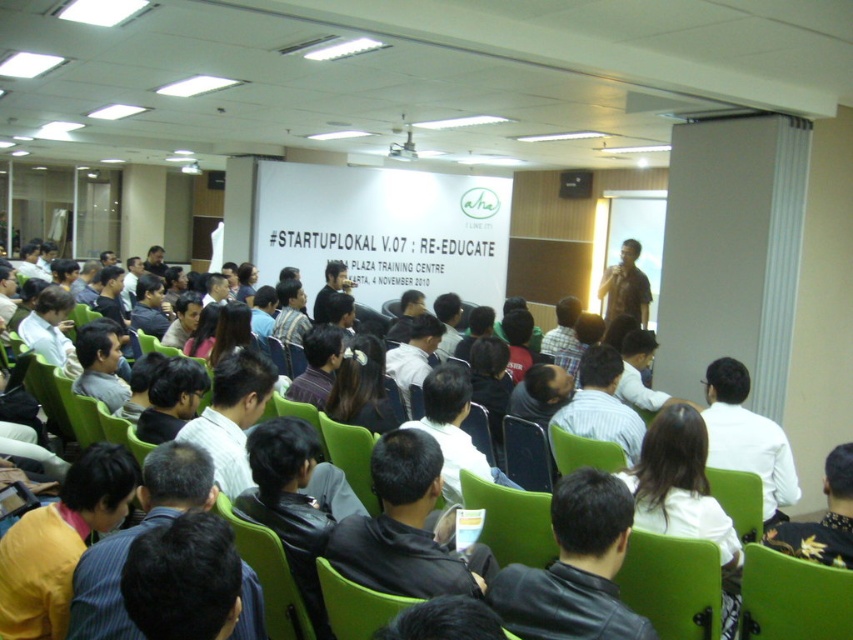
Question: Which point appears closest to the camera in this image?

Choices:
 (A) (349, 413)
 (B) (773, 566)

Answer: (B)

Question: Based on their relative distances, which object is nearer to the green fabric chair at lower right?

Choices:
 (A) yellow shirt at lower left
 (B) black leather jacket at lower right

Answer: (B)

Question: Does black hair at center have a lesser width compared to matte white shirt at center?

Choices:
 (A) yes
 (B) no

Answer: (A)

Question: Does yellow shirt at lower left appear on the left side of dark brown leather jacket at lower left?

Choices:
 (A) no
 (B) yes

Answer: (A)

Question: Which of the following is the closest to the observer?

Choices:
 (A) black hair at center
 (B) black leather jacket at lower right
 (C) dark brown leather jacket at lower left

Answer: (B)

Question: Is black leather jacket at lower center to the right of yellow shirt at lower left from the viewer's perspective?

Choices:
 (A) yes
 (B) no

Answer: (A)